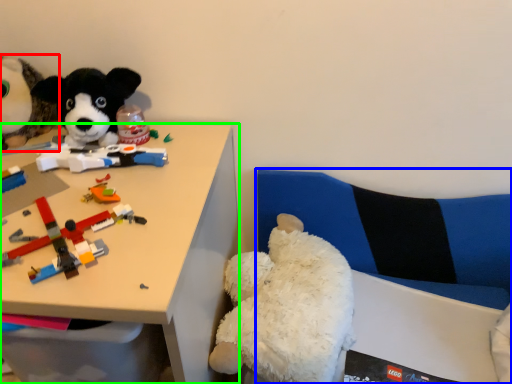
Question: Which object is positioned closest to toy (highlighted by a red box)? Select from couch (highlighted by a blue box) and desk (highlighted by a green box).

Choices:
 (A) couch
 (B) desk

Answer: (B)